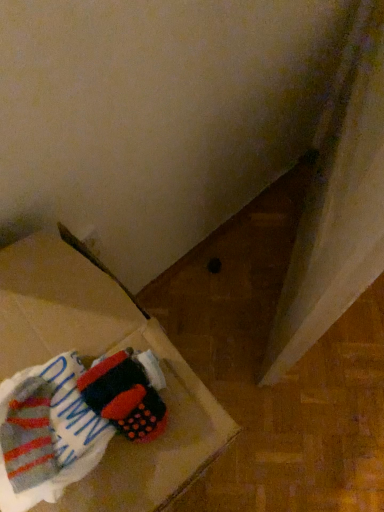
At what (x,y) coordinates should I click in order to perform the action: click on white fabric at lower left. Please return your answer as a coordinate pair (x, y). The width and height of the screenshot is (384, 512). Looking at the image, I should click on (x=98, y=355).

This screenshot has height=512, width=384. What do you see at coordinates (98, 355) in the screenshot? I see `white fabric at lower left` at bounding box center [98, 355].

Measure the distance between striped cotton socks at lower left and camera.

A distance of 15.92 inches exists between striped cotton socks at lower left and camera.

The image size is (384, 512). I want to click on striped cotton socks at lower left, so click(72, 420).

What do you see at coordinates (72, 420) in the screenshot?
I see `striped cotton socks at lower left` at bounding box center [72, 420].

Image resolution: width=384 pixels, height=512 pixels. What are the coordinates of `white fabric at lower left` in the screenshot? It's located at pos(98,355).

Which is more to the right, white fabric at lower left or striped cotton socks at lower left?

striped cotton socks at lower left is more to the right.

Considering the relative positions of white fabric at lower left and striped cotton socks at lower left in the image provided, is white fabric at lower left in front of striped cotton socks at lower left?

Yes, white fabric at lower left is in front of striped cotton socks at lower left.

Which is in front, point (90, 343) or point (91, 459)?

The point (91, 459) is more forward.

From the image's perspective, is white fabric at lower left located above striped cotton socks at lower left?

No, from the image's perspective, white fabric at lower left is not over striped cotton socks at lower left.

From a real-world perspective, is white fabric at lower left over striped cotton socks at lower left?

Incorrect, from a real-world perspective, white fabric at lower left is lower than striped cotton socks at lower left.

In terms of width, does white fabric at lower left look wider or thinner when compared to striped cotton socks at lower left?

In the image, white fabric at lower left appears to be wider than striped cotton socks at lower left.

Who is taller, white fabric at lower left or striped cotton socks at lower left?

white fabric at lower left is taller.

Considering the relative sizes of white fabric at lower left and striped cotton socks at lower left in the image provided, is white fabric at lower left smaller than striped cotton socks at lower left?

Incorrect, white fabric at lower left is not smaller in size than striped cotton socks at lower left.

Is white fabric at lower left inside the boundaries of striped cotton socks at lower left, or outside?

white fabric at lower left is located beyond the bounds of striped cotton socks at lower left.

Are white fabric at lower left and striped cotton socks at lower left far apart?

No, white fabric at lower left is in close proximity to striped cotton socks at lower left.

In the scene shown: Does white fabric at lower left turn towards striped cotton socks at lower left?

No.

In order to click on cardboard box that appears on the left of striped cotton socks at lower left in this screenshot , I will do `click(98, 355)`.

Is striped cotton socks at lower left to the left or to the right of white fabric at lower left in the image?

From the image, it's evident that striped cotton socks at lower left is to the right of white fabric at lower left.

Is striped cotton socks at lower left positioned before white fabric at lower left?

No, striped cotton socks at lower left is further to the viewer.

Which point is more forward, (10, 484) or (44, 347)?

The point (10, 484) is closer.

Consider the image. From the image's perspective, between striped cotton socks at lower left and white fabric at lower left, which one is located above?

striped cotton socks at lower left, from the image's perspective.

From a real-world perspective, between striped cotton socks at lower left and white fabric at lower left, who is vertically lower?

In real-world perspective, white fabric at lower left is lower.

Does striped cotton socks at lower left have a greater width compared to white fabric at lower left?

In fact, striped cotton socks at lower left might be narrower than white fabric at lower left.

Considering the sizes of striped cotton socks at lower left and white fabric at lower left in the image, is striped cotton socks at lower left taller or shorter than white fabric at lower left?

In the image, striped cotton socks at lower left appears to be shorter than white fabric at lower left.

Can you confirm if striped cotton socks at lower left is bigger than white fabric at lower left?

No.

Choose the correct answer: Is striped cotton socks at lower left inside white fabric at lower left or outside it?

striped cotton socks at lower left is enclosed within white fabric at lower left.

Is striped cotton socks at lower left next to white fabric at lower left?

Yes, striped cotton socks at lower left is touching white fabric at lower left.

Is striped cotton socks at lower left oriented away from white fabric at lower left?

No, striped cotton socks at lower left is not facing the opposite direction of white fabric at lower left.

Can you tell me how much striped cotton socks at lower left and white fabric at lower left differ in facing direction?

They differ by 2.89 degrees in their facing directions.

How distant is striped cotton socks at lower left from white fabric at lower left?

The distance of striped cotton socks at lower left from white fabric at lower left is 2.58 inches.

You are a GUI agent. You are given a task and a screenshot of the screen. Output one action in this format:
    pyautogui.click(x=<x>, y=<y>)
    Task: Click on the cardboard box located underneath the striped cotton socks at lower left (from a real-world perspective)
    
    Given the screenshot: What is the action you would take?
    pyautogui.click(x=98, y=355)

You are a GUI agent. You are given a task and a screenshot of the screen. Output one action in this format:
    pyautogui.click(x=<x>, y=<y>)
    Task: Click on the laundry above the white fabric at lower left (from a real-world perspective)
    This screenshot has height=512, width=384.
    Given the screenshot: What is the action you would take?
    pyautogui.click(x=72, y=420)

Image resolution: width=384 pixels, height=512 pixels. In the image, there is a striped cotton socks at lower left. What are the coordinates of `cardboard box below it (from the image's perspective)` in the screenshot? It's located at (98, 355).